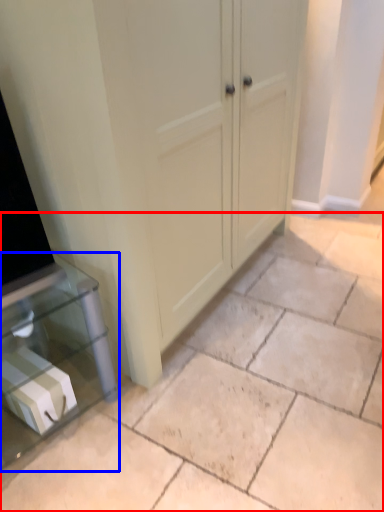
Question: Which point is further to the camera, concrete (highlighted by a red box) or furniture (highlighted by a blue box)?

Choices:
 (A) concrete
 (B) furniture

Answer: (B)